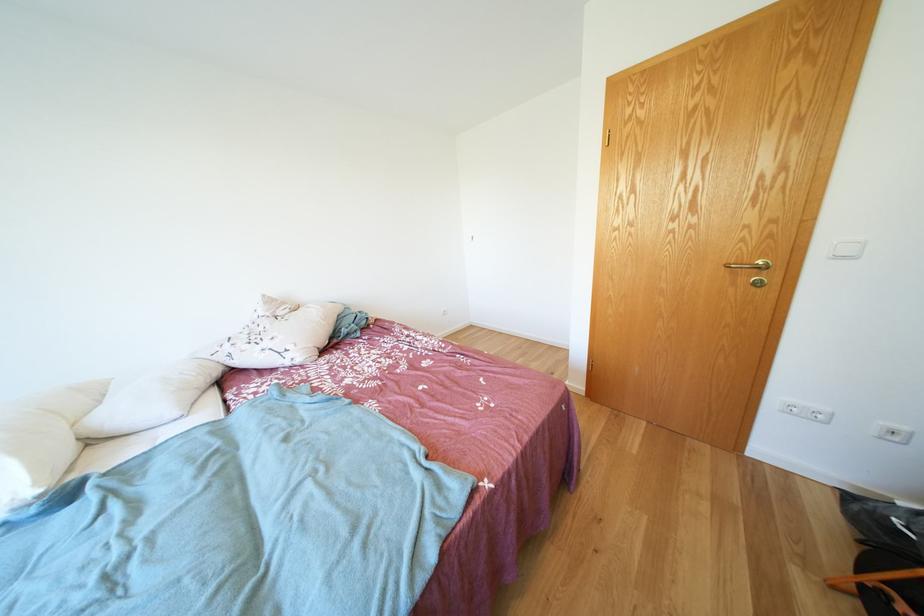
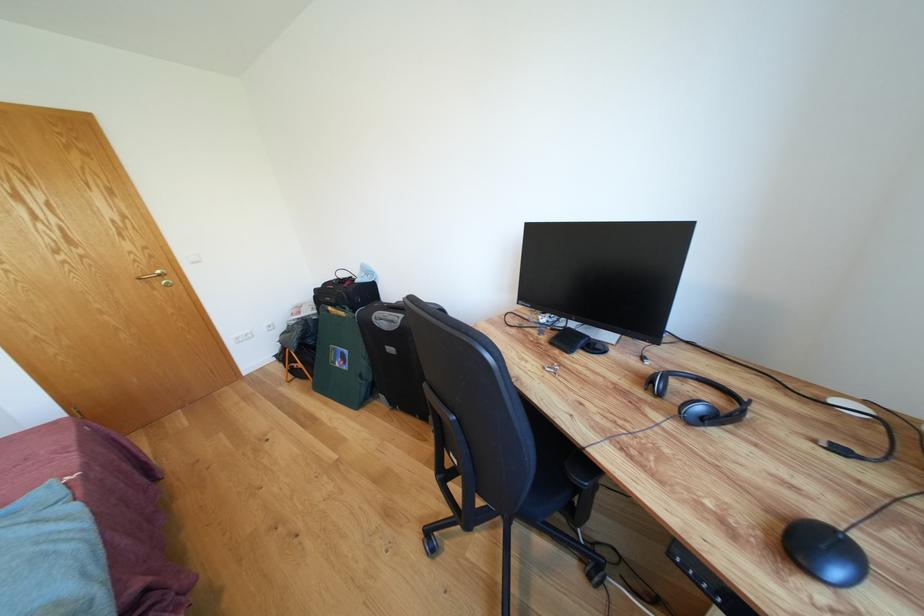
The point at (x=769, y=265) is marked in the first image. Where is the corresponding point in the second image?

(167, 277)